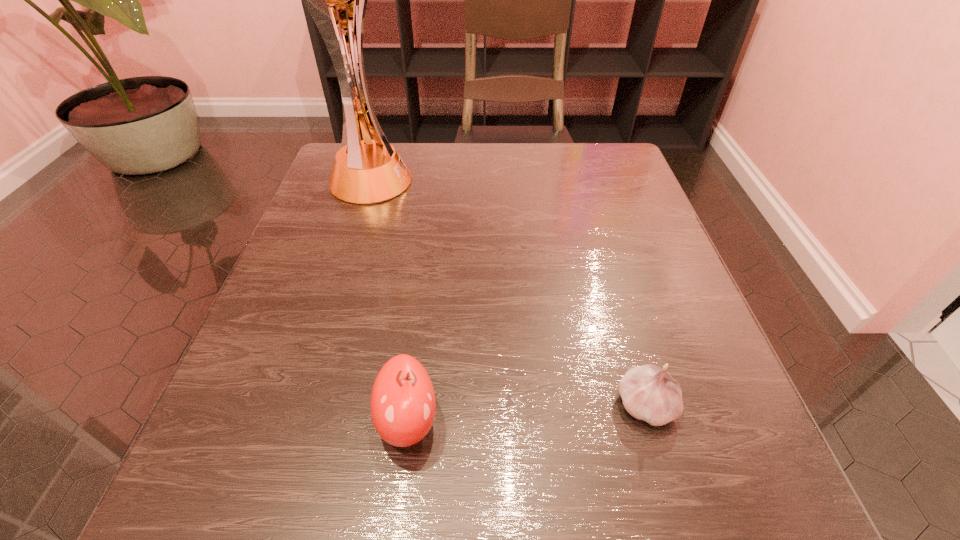
This screenshot has width=960, height=540. Find the location of `the tallest object`. the tallest object is located at coordinates (370, 171).

Where is `the farthest object`? The image size is (960, 540). the farthest object is located at coordinates (370, 171).

Find the location of `the second object from left to right`. the second object from left to right is located at coordinates (403, 404).

Locate an element on the screen. the rightmost object is located at coordinates (649, 393).

Where is `free location located 0.130m on the front-facing side of the leftmost object`? The image size is (960, 540). free location located 0.130m on the front-facing side of the leftmost object is located at coordinates (468, 182).

Image resolution: width=960 pixels, height=540 pixels. I want to click on blank space located on the back of the second object from right to left, so click(416, 355).

This screenshot has height=540, width=960. Identify the location of free location located 0.240m on the left of the garlic. (442, 405).

This screenshot has height=540, width=960. I want to click on object located in the far edge section of the desktop, so click(370, 171).

Identify the location of object that is at the near edge. The height and width of the screenshot is (540, 960). (403, 404).

Where is `object that is positioned at the left edge`? The image size is (960, 540). object that is positioned at the left edge is located at coordinates (370, 171).